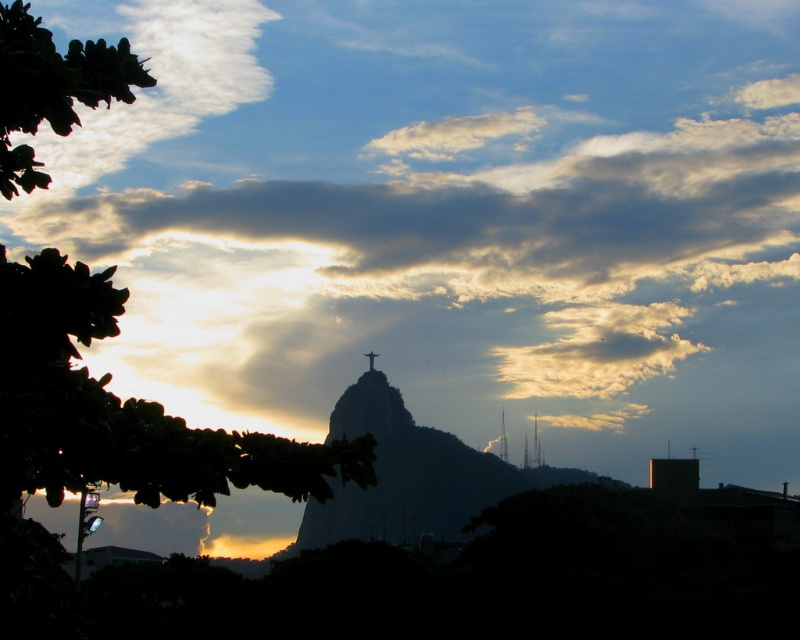
Is point (428, 472) positioned after point (210, 60)?

No, it is not.

Between point (393, 477) and point (36, 140), which one is positioned behind?

Positioned behind is point (36, 140).

Identify the location of silvery metallic statue at center. (412, 476).

Consider the image. Which is more to the left, cloudy sky at upper center or metallic gold cross at center?

From the viewer's perspective, metallic gold cross at center appears more on the left side.

Is cloudy sky at upper center to the right of metallic gold cross at center from the viewer's perspective?

Indeed, cloudy sky at upper center is positioned on the right side of metallic gold cross at center.

From the picture: Measure the distance between point (x=200, y=216) and camera.

Point (x=200, y=216) is 665.13 meters from camera.

In order to click on cloudy sky at upper center in this screenshot , I will do `click(492, 202)`.

Describe the element at coordinates (121, 410) in the screenshot. I see `green leafy tree at left` at that location.

Is green leafy tree at left smaller than metallic spire at upper center?

Incorrect, green leafy tree at left is not smaller in size than metallic spire at upper center.

The height and width of the screenshot is (640, 800). In order to click on green leafy tree at left in this screenshot , I will do pyautogui.click(x=121, y=410).